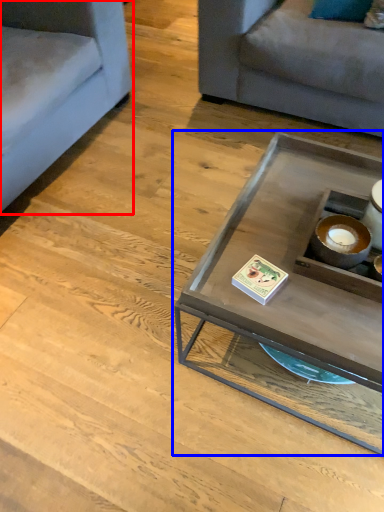
Question: Which object is further to the camera taking this photo, studio couch (highlighted by a red box) or coffee table (highlighted by a blue box)?

Choices:
 (A) studio couch
 (B) coffee table

Answer: (A)